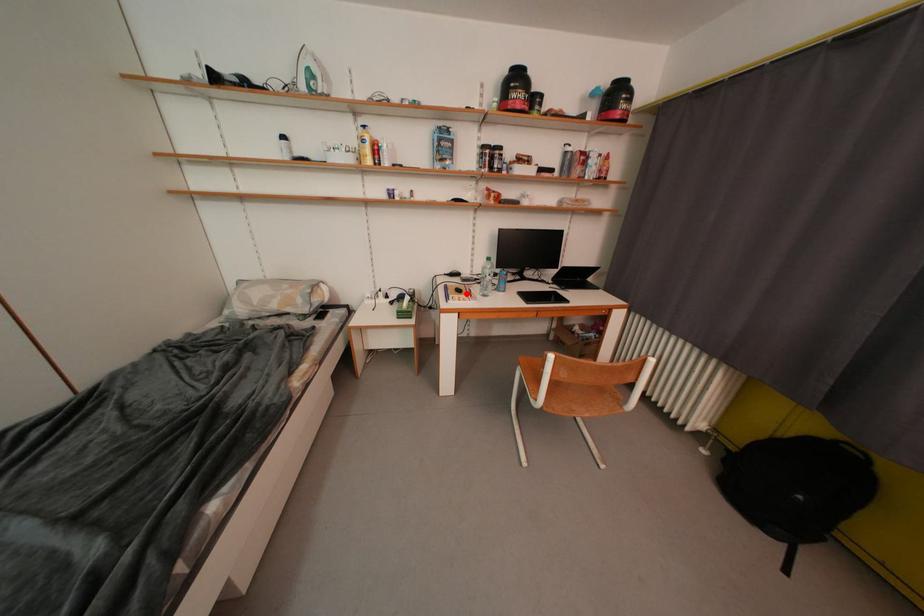
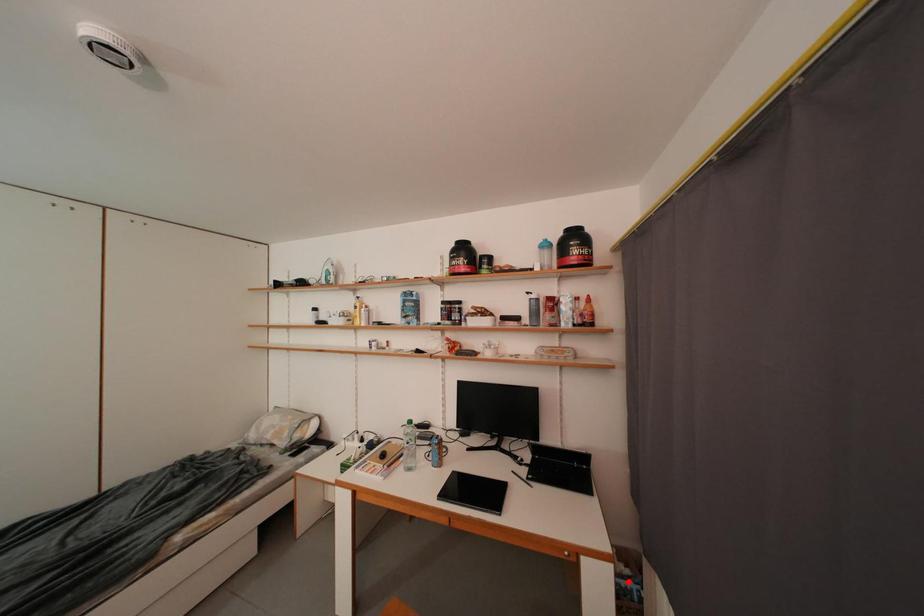
I am providing you with two images of the same scene from different viewpoints. A red point is marked on the first image and another point is marked on the second image. Do the highlighted points in image1 and image2 indicate the same real-world spot?

No